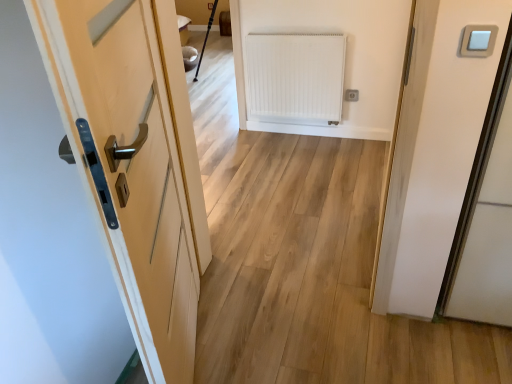
Question: In terms of width, does white plastic light switch at upper right look wider or thinner when compared to white plastic electric outlet at upper right?

Choices:
 (A) thin
 (B) wide

Answer: (A)

Question: Considering their positions, is white plastic light switch at upper right located in front of or behind white plastic electric outlet at upper right?

Choices:
 (A) behind
 (B) front

Answer: (B)

Question: Considering the real-world distances, which object is farthest from the white plastic light switch at upper right?

Choices:
 (A) white matte radiator at center
 (B) white plastic electric outlet at upper right
 (C) matte wood door at left

Answer: (A)

Question: Estimate the real-world distances between objects in this image. Which object is closer to the white plastic light switch at upper right?

Choices:
 (A) white plastic electric outlet at upper right
 (B) matte wood door at left
 (C) white matte radiator at center

Answer: (B)